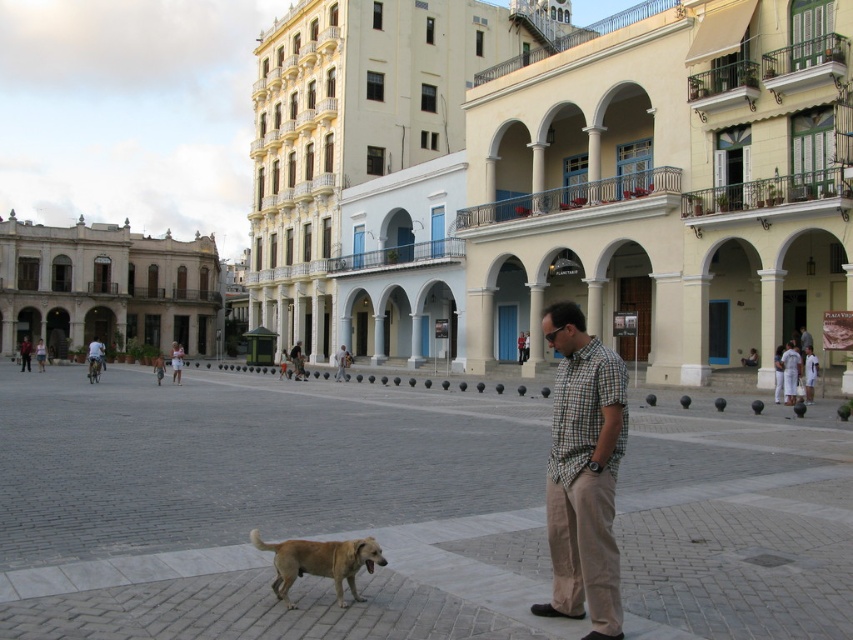
Question: Which object appears farthest from the camera in this image?

Choices:
 (A) light brown plaid shirt at center
 (B) beige stone building at left
 (C) brown fur dog at center

Answer: (B)

Question: Can you confirm if light brown plaid shirt at center is positioned to the left of checkered fabric shirt at center?

Choices:
 (A) no
 (B) yes

Answer: (B)

Question: Does khaki cotton pants at center right appear on the left side of light brown plaid shirt at center?

Choices:
 (A) no
 (B) yes

Answer: (A)

Question: Which of the following is the closest to the observer?

Choices:
 (A) (280, 557)
 (B) (369, 577)
 (C) (556, 499)
 (D) (91, 365)

Answer: (C)

Question: Can you confirm if beige stone building at left is wider than golden fur dog at lower center?

Choices:
 (A) no
 (B) yes

Answer: (B)

Question: Estimate the real-world distances between objects in this image. Which object is farther from the brown fur dog at center?

Choices:
 (A) checkered fabric shirt at center
 (B) golden fur dog at lower center
 (C) beige stone building at left

Answer: (C)